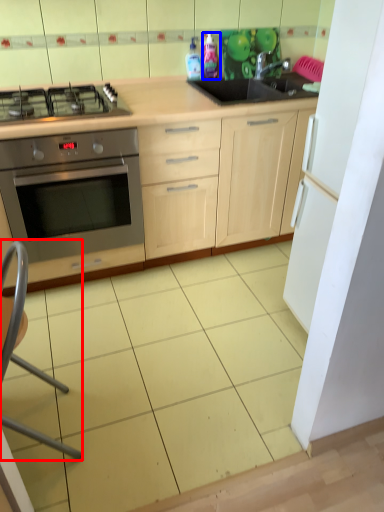
Question: Which of the following is the farthest to the observer, folding chair (highlighted by a red box) or bottle (highlighted by a blue box)?

Choices:
 (A) folding chair
 (B) bottle

Answer: (B)